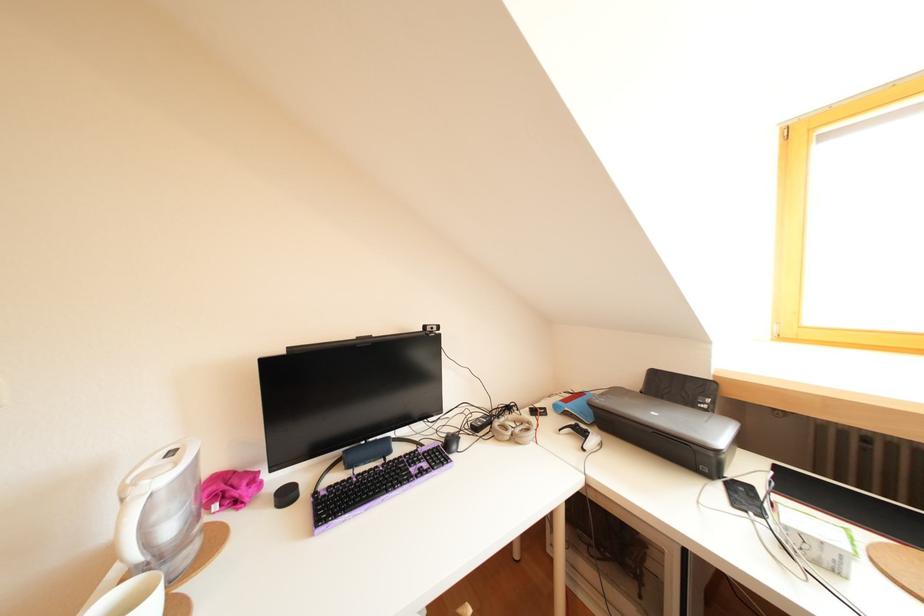
Describe the element at coordinates (667, 429) in the screenshot. I see `the printer lid` at that location.